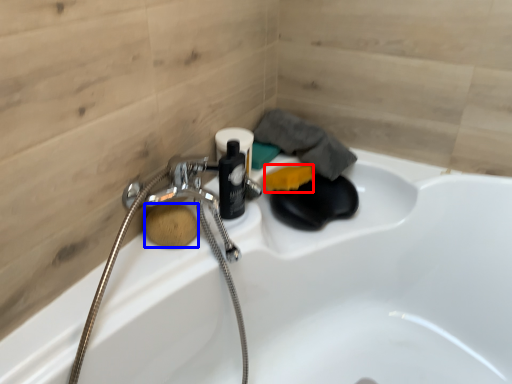
Question: Which point is closer to the camera, soap (highlighted by a red box) or soap (highlighted by a blue box)?

Choices:
 (A) soap
 (B) soap

Answer: (B)